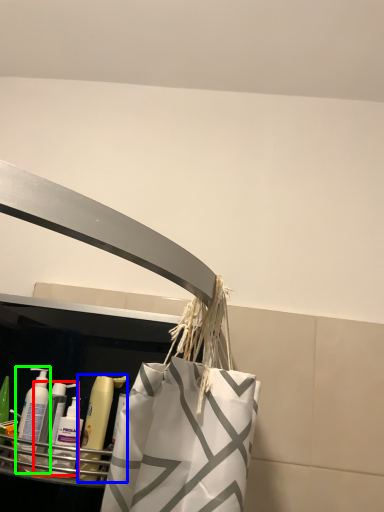
Question: Estimate the real-world distances between objects in this image. Which object is farther from cleaning product (highlighted by a red box), mouthwash (highlighted by a blue box) or cleaning product (highlighted by a green box)?

Choices:
 (A) mouthwash
 (B) cleaning product

Answer: (A)